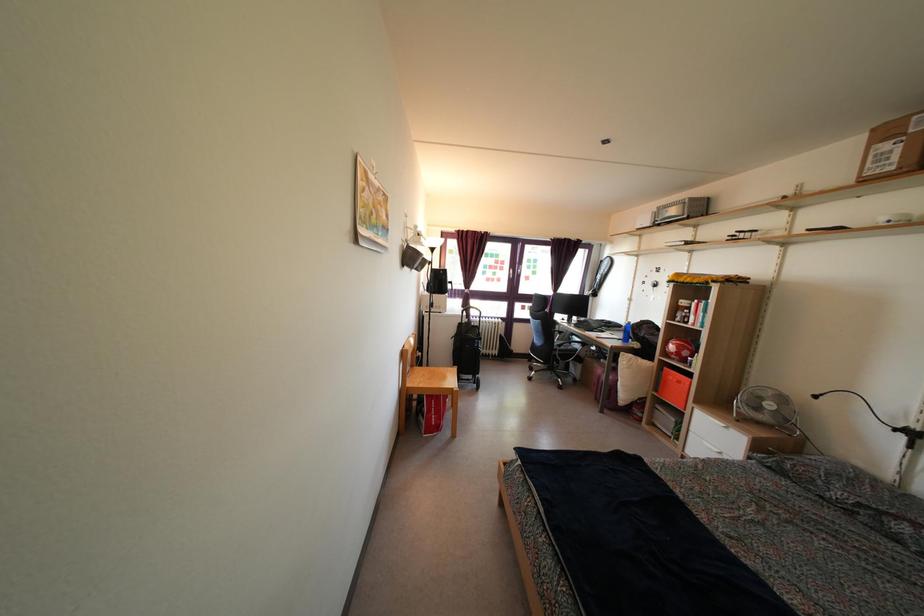
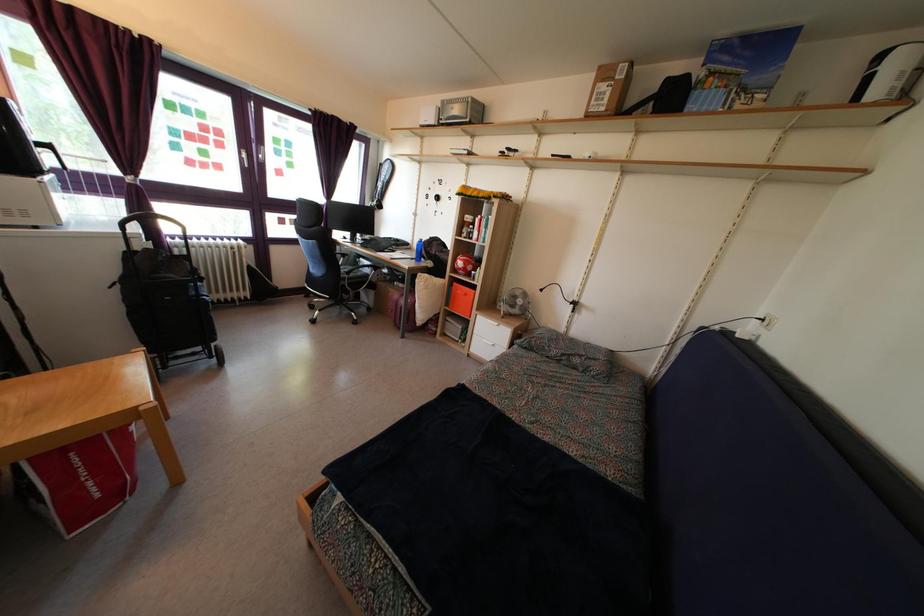
In the second image, find the point that corresponds to (563,341) in the first image.

(346, 264)